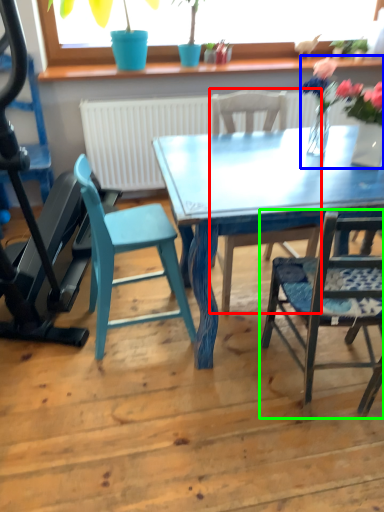
Question: Estimate the real-world distances between objects in this image. Which object is closer to chair (highlighted by a red box), floral arrangement (highlighted by a blue box) or chair (highlighted by a green box)?

Choices:
 (A) floral arrangement
 (B) chair

Answer: (B)